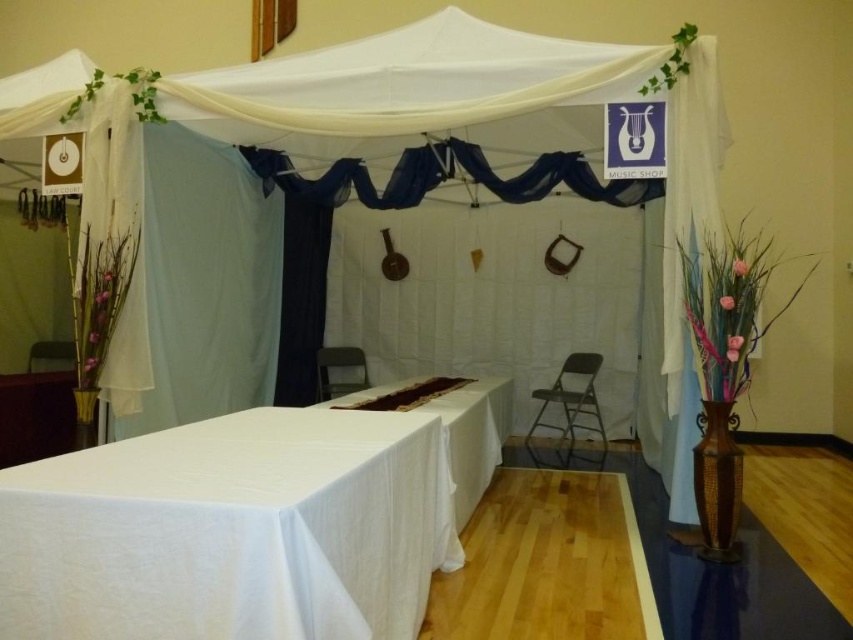
You are setting up a small event and need to place a 1.2 meter wide decoration on the table. Given the white cloth table at center and the metallic gray folding chair at center, can the decoration fit on the table?

The white cloth table at center is bigger than the metallic gray folding chair at center, but the exact dimensions are not provided. However, since the table is larger, it might accommodate the decoration, but there is uncertainty without specific measurements.

You are standing at the entrance of the canopy and want to place a decorative centerpiece on the white fabric tablecloth at center. If your current position is at point 0,0, what are the coordinates where you should place the centerpiece?

The coordinates for placing the decorative centerpiece on the white fabric tablecloth at center are at point (231, 531).

You are a customer entering the store and see the white cloth table at center and the metallic gray folding chair at center. Which object is closer to the entrance?

The metallic gray folding chair at center is closer to the entrance because the white cloth table at center is located above it, meaning the chair is positioned in front of the table.